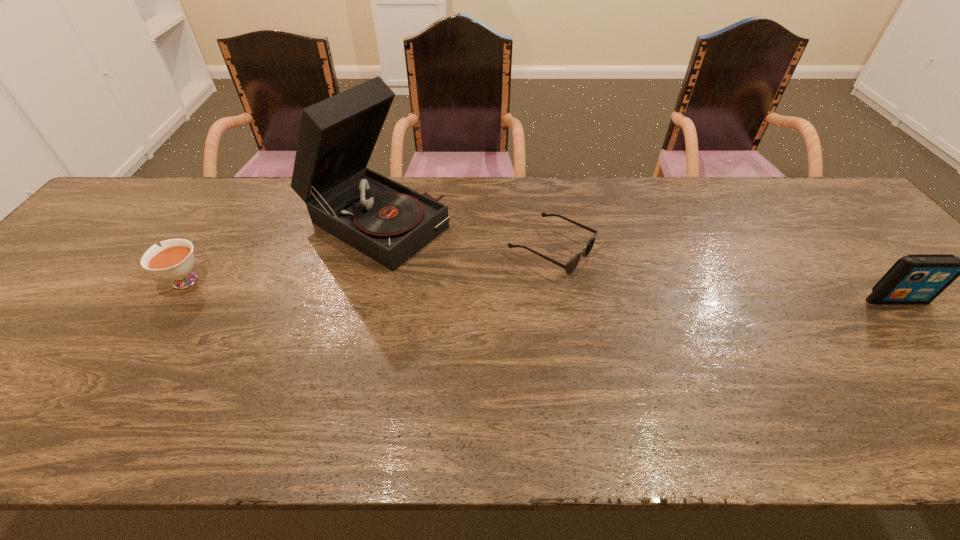
The height and width of the screenshot is (540, 960). Find the location of `teacup`. teacup is located at coordinates (174, 260).

Identify the location of the second shortest object. The width and height of the screenshot is (960, 540). (174, 260).

Locate an element on the screen. This screenshot has width=960, height=540. the rightmost object is located at coordinates (916, 278).

Image resolution: width=960 pixels, height=540 pixels. I want to click on the second tallest object, so click(x=916, y=278).

Locate an element on the screen. The image size is (960, 540). phonograph_record is located at coordinates pos(388,222).

Where is `the third object from right to left`? The height and width of the screenshot is (540, 960). the third object from right to left is located at coordinates (388, 222).

Where is `the second object from right to left`? Image resolution: width=960 pixels, height=540 pixels. the second object from right to left is located at coordinates (572, 264).

This screenshot has height=540, width=960. In order to click on the shortest object in this screenshot , I will do [x=572, y=264].

Find the location of a particular element. This screenshot has width=960, height=540. vacant area situated on the side of the second shortest object with the handle is located at coordinates (130, 281).

Locate an element on the screen. free spot located on the side of the second shortest object with the handle is located at coordinates (102, 281).